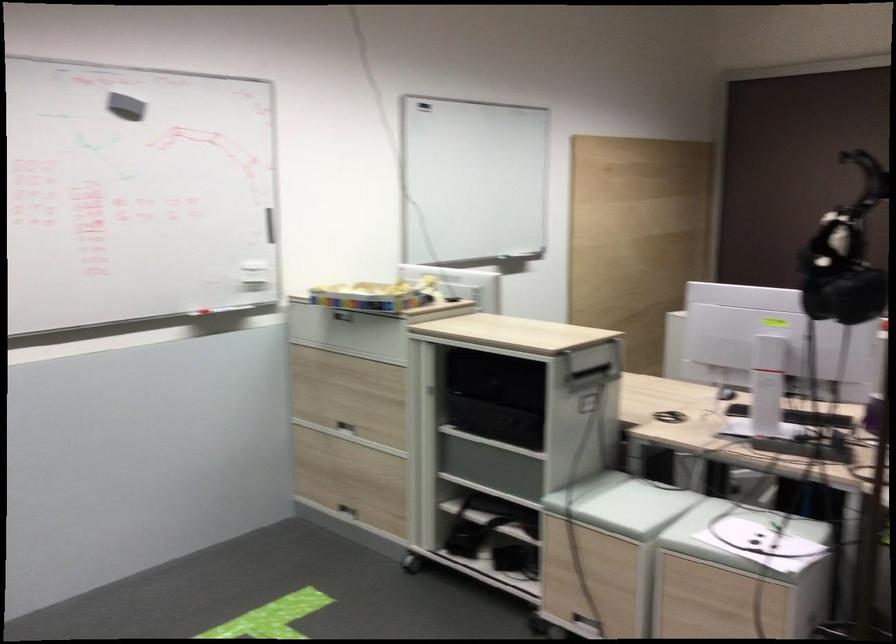
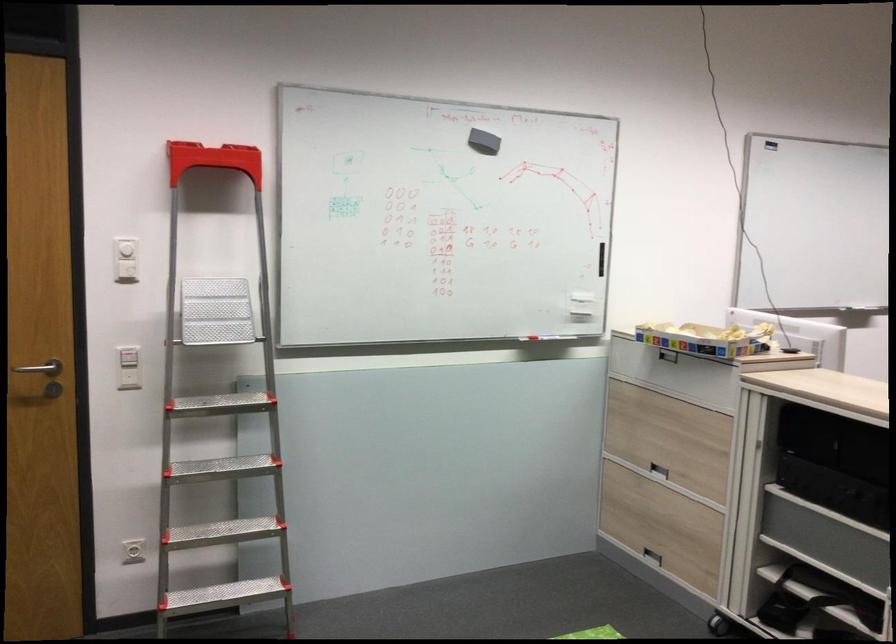
Locate, in the second image, the point that corresponds to pixel 134 118 in the first image.

(483, 142)